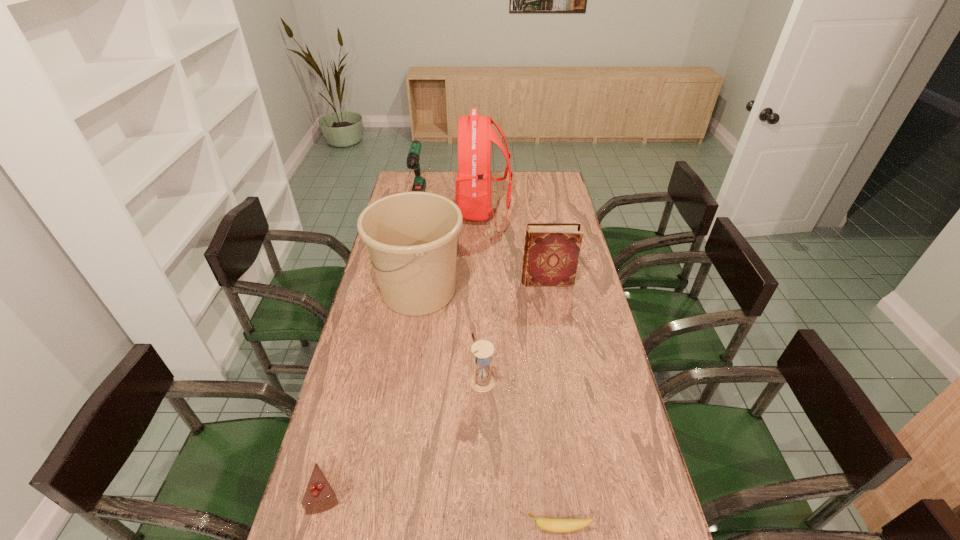
The image size is (960, 540). What are the coordinates of `vacant space that satisfies the following two spatial constraints: 1. on the handle side of the drill; 2. on the right side of the bucket` in the screenshot? It's located at (399, 292).

You are a GUI agent. You are given a task and a screenshot of the screen. Output one action in this format:
    pyautogui.click(x=<x>, y=<y>)
    Task: Click on the free space that satisfies the following two spatial constraints: 1. on the spine side of the hardback book; 2. on the front side of the bucket
    The height and width of the screenshot is (540, 960).
    Given the screenshot: What is the action you would take?
    pyautogui.click(x=549, y=292)

Where is `free point that satisfies the following two spatial constraints: 1. on the main compartment of the tallest object; 2. on the front side of the hourglass`? The width and height of the screenshot is (960, 540). free point that satisfies the following two spatial constraints: 1. on the main compartment of the tallest object; 2. on the front side of the hourglass is located at coordinates (485, 381).

Image resolution: width=960 pixels, height=540 pixels. Find the location of `vacant region that satisfies the following two spatial constraints: 1. on the handle side of the third shortest object; 2. on the left side of the drill`. vacant region that satisfies the following two spatial constraints: 1. on the handle side of the third shortest object; 2. on the left side of the drill is located at coordinates [381, 381].